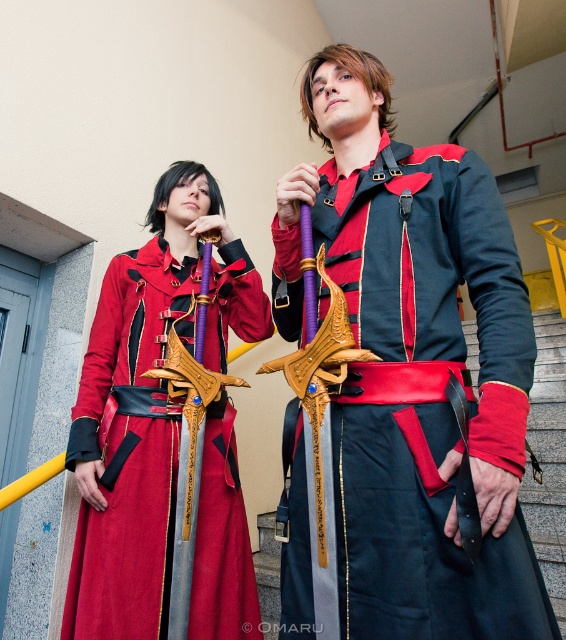
Question: Can you confirm if matte black sword at center is smaller than satin red dress at center?

Choices:
 (A) yes
 (B) no

Answer: (A)

Question: From the image, what is the correct spatial relationship of matte black sword at center in relation to satin red dress at center?

Choices:
 (A) left
 (B) right

Answer: (B)

Question: Can you confirm if matte black sword at center is positioned above satin red dress at center?

Choices:
 (A) yes
 (B) no

Answer: (A)

Question: Which point is closer to the camera?

Choices:
 (A) matte black sword at center
 (B) satin red dress at center

Answer: (A)

Question: Among these objects, which one is nearest to the camera?

Choices:
 (A) satin red dress at center
 (B) matte black sword at center

Answer: (B)

Question: Which object appears closest to the camera in this image?

Choices:
 (A) matte black sword at center
 (B) satin red dress at center

Answer: (A)